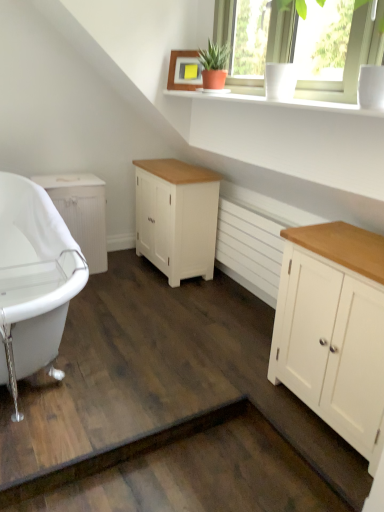
Identify the location of vacant space underneath white smooth window sill at upper center (from a real-world perspective). (223, 322).